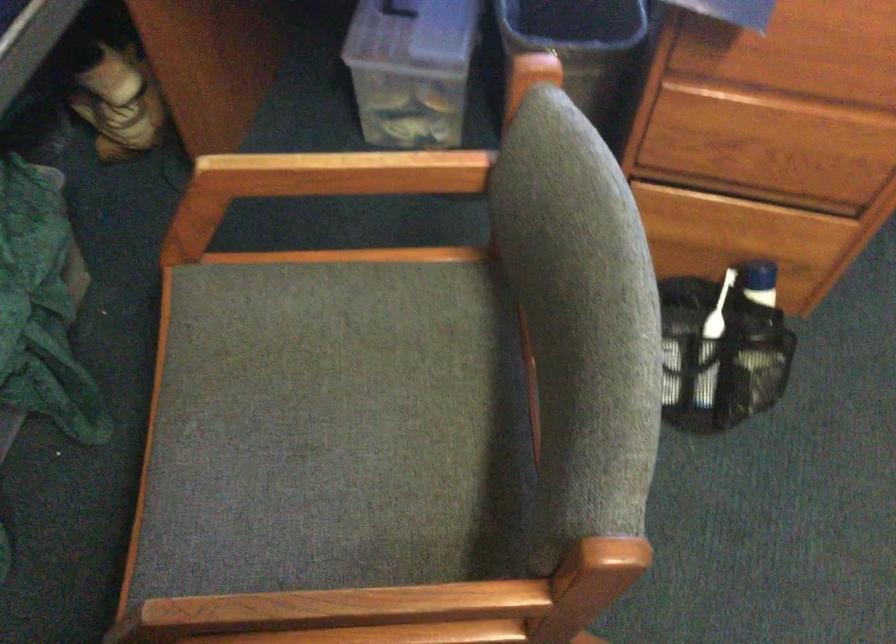
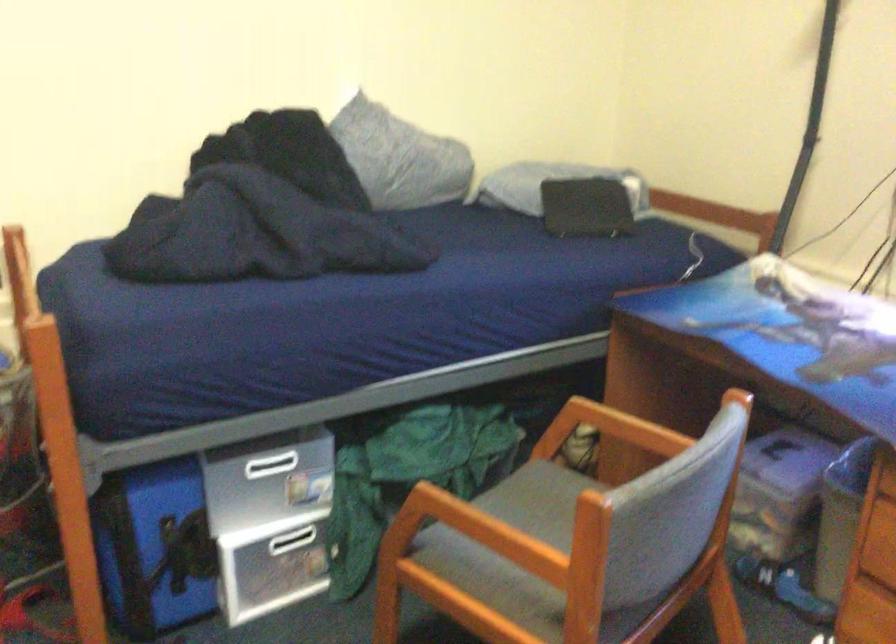
Where in the second image is the point corresponding to pixel 240 391 from the first image?

(519, 518)